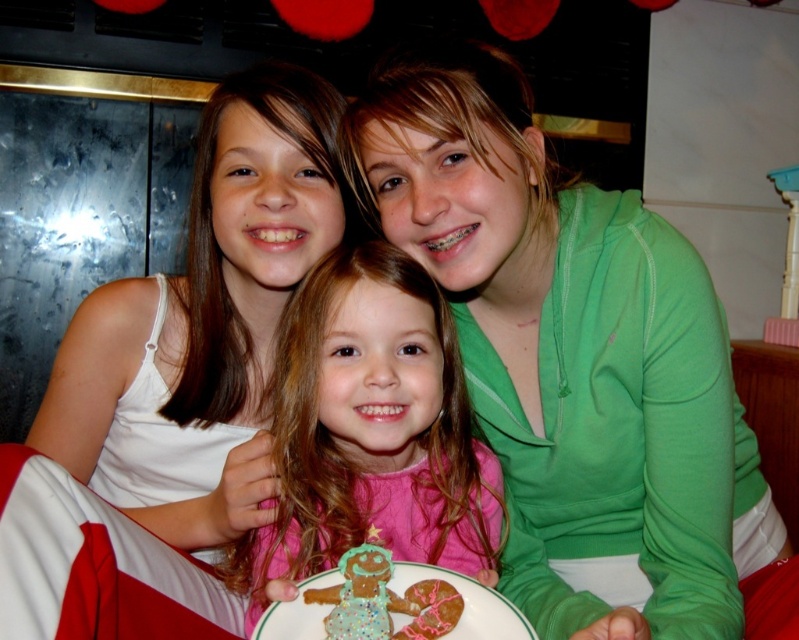
You are planning to take a photo of the group and want to ensure both the green soft hoodie at center and the green matte sweater at upper right are visible. Based on their positions, which one should you focus on first to frame the photo properly?

You should focus on the green matte sweater at upper right first because the green soft hoodie at center is to its right, so positioning the frame to include the sweater on the left side will naturally include the hoodie on the right.

You are a photographer trying to capture a group photo of the green matte sweater at upper right and the pink matte dress at center. If your camera has a maximum focus range of 6 inches, will both subjects be in focus?

The distance between the green matte sweater at upper right and the pink matte dress at center is 5.83 inches, which is within the camera maximum focus range of 6 inches. Therefore, both subjects will be in focus.

You are planning to buy a new outfit that matches the style of the green matte sweater at upper right and the pink matte dress at center. Based on their heights, which one would be more suitable for a formal event where longer garments are preferred?

The green matte sweater at upper right is taller than the pink matte dress at center, so it would be more suitable for a formal event where longer garments are preferred.